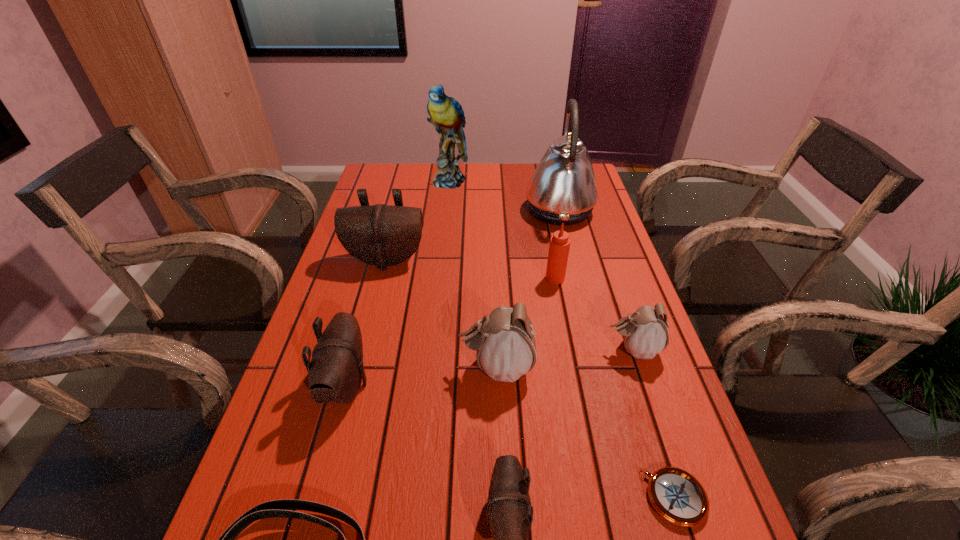
Find the location of a particular element. free space located 0.330m on the face of the parrot is located at coordinates (442, 251).

The height and width of the screenshot is (540, 960). What are the coordinates of `vacant space located 0.380m on the front of the kettle` in the screenshot? It's located at (588, 327).

You are a GUI agent. You are given a task and a screenshot of the screen. Output one action in this format:
    pyautogui.click(x=<x>, y=<y>)
    Task: Click on the free space located with the flap open on the farthest pouch
    
    Given the screenshot: What is the action you would take?
    pyautogui.click(x=360, y=360)

This screenshot has width=960, height=540. Find the location of `free location located on the front-facing side of the left white pouch`. free location located on the front-facing side of the left white pouch is located at coordinates (414, 368).

Locate an element on the screen. Image resolution: width=960 pixels, height=540 pixels. vacant space located 0.200m on the front-facing side of the left white pouch is located at coordinates (368, 368).

Where is `vacant region located on the front-facing side of the left white pouch`? vacant region located on the front-facing side of the left white pouch is located at coordinates tap(396, 368).

Locate an element on the screen. The width and height of the screenshot is (960, 540). vacant space located 0.090m on the right of the Tabasco sauce is located at coordinates (598, 279).

Where is `free spot located with the flap open on the second nearest brown pouch`? This screenshot has height=540, width=960. free spot located with the flap open on the second nearest brown pouch is located at coordinates (507, 385).

Identify the location of vacant space located on the front-facing side of the rightmost pouch. (505, 350).

You are a GUI agent. You are given a task and a screenshot of the screen. Output one action in this format:
    pyautogui.click(x=<x>, y=<y>)
    Task: Click on the vacant area located 0.090m on the front-facing side of the rightmost pouch
    
    Given the screenshot: What is the action you would take?
    pyautogui.click(x=566, y=350)